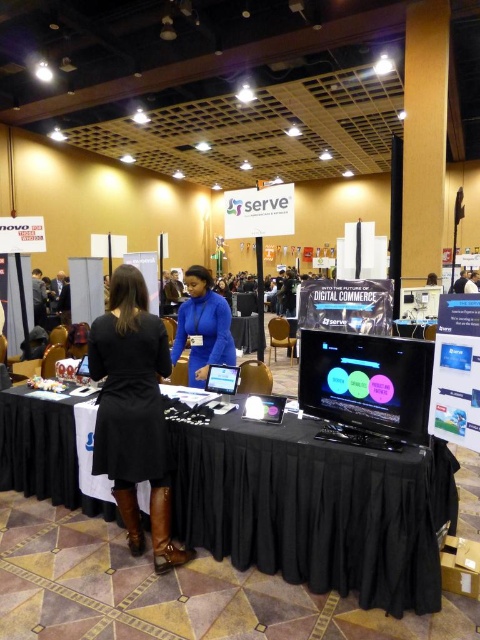
Who is more forward, (250,477) or (416,324)?

Point (250,477) is more forward.

Is black fabric table at center positioned behind black glossy table at center?

No, it is in front of black glossy table at center.

Between point (169, 451) and point (405, 333), which one is positioned in front?

Point (169, 451)

The image size is (480, 640). Find the location of `black fabric table at center`. black fabric table at center is located at coordinates (315, 509).

Looking at this image, between matte black monitor at center and blue matte jacket at center, which one is positioned higher?

blue matte jacket at center is higher up.

Between matte black monitor at center and blue matte jacket at center, which one appears on the left side from the viewer's perspective?

blue matte jacket at center is more to the left.

Find the location of a particular element. The width and height of the screenshot is (480, 640). matte black monitor at center is located at coordinates (367, 381).

Where is `matte black monitor at center`? matte black monitor at center is located at coordinates (367, 381).

Does matte black monitor at center appear under black glossy table at center?

Indeed, matte black monitor at center is positioned under black glossy table at center.

Is the position of matte black monitor at center less distant than that of black glossy table at center?

Yes.

Is point (418, 380) positioned before point (420, 321)?

Yes, it is in front of point (420, 321).

At what (x,y) coordinates should I click in order to perform the action: click on matte black monitor at center. Please return your answer as a coordinate pair (x, y). This screenshot has height=640, width=480. Looking at the image, I should click on (367, 381).